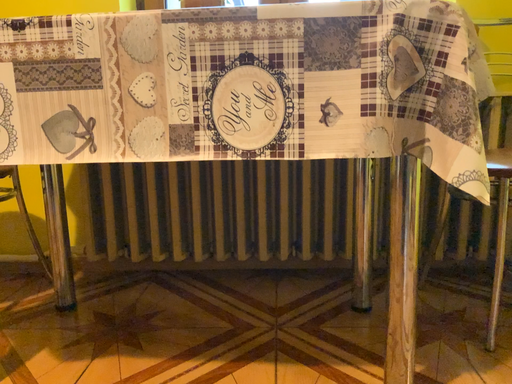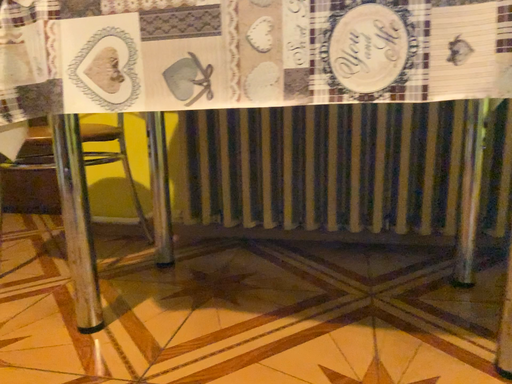
Question: Which way did the camera rotate in the video?

Choices:
 (A) rotated left
 (B) rotated right

Answer: (A)